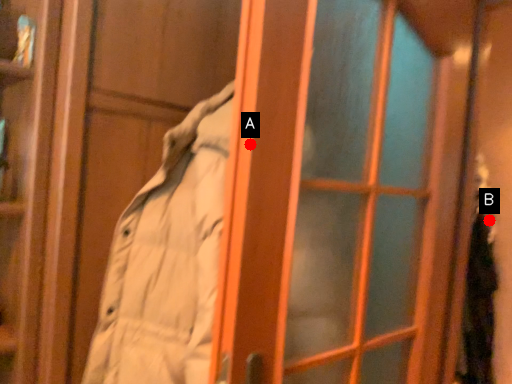
Question: Two points are circled on the image, labeled by A and B beside each circle. Which point appears farthest from the camera in this image?

Choices:
 (A) A is further
 (B) B is further

Answer: (B)